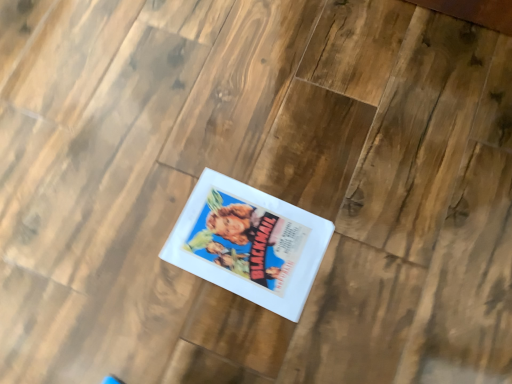
Where is `empty space that is to the right of white glossy paperback book at center`? The height and width of the screenshot is (384, 512). empty space that is to the right of white glossy paperback book at center is located at coordinates (365, 239).